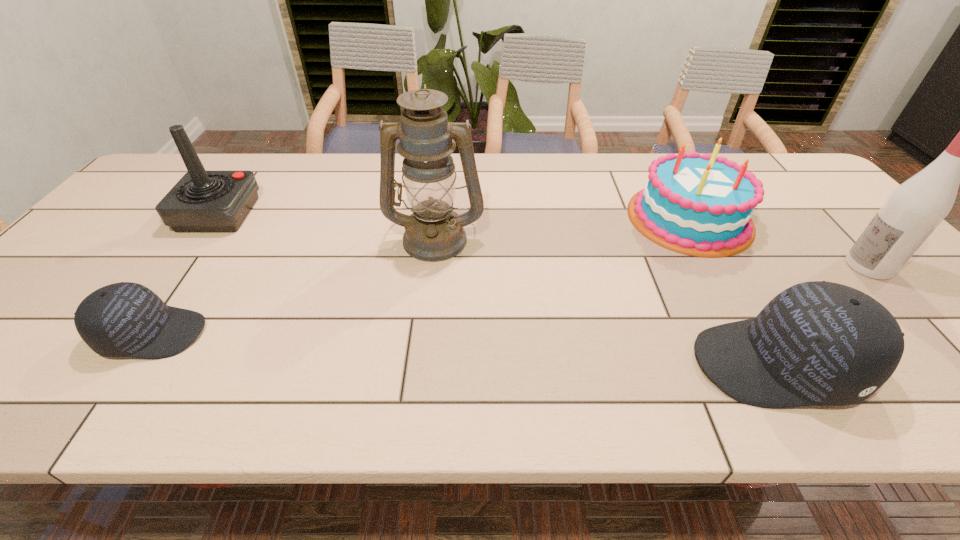
Locate an element on the screen. the left baseball cap is located at coordinates (125, 319).

Locate an element on the screen. the shortest object is located at coordinates (125, 319).

The width and height of the screenshot is (960, 540). What are the coordinates of `the taller baseball cap` in the screenshot? It's located at (818, 343).

Locate an element on the screen. birthday cake is located at coordinates (700, 205).

You are a GUI agent. You are given a task and a screenshot of the screen. Output one action in this format:
    pyautogui.click(x=<x>, y=<y>)
    Task: Click on the alcohol
    Image resolution: width=960 pixels, height=540 pixels.
    Given the screenshot: What is the action you would take?
    pyautogui.click(x=915, y=208)

Where is `the third tallest object`? This screenshot has height=540, width=960. the third tallest object is located at coordinates (201, 201).

Locate an element on the screen. This screenshot has width=960, height=540. the fourth object from right to left is located at coordinates (433, 232).

Identify the location of vacant space situated at the front of the left baseball cap where the brim is located. (236, 334).

Identify the location of vacant space located 0.150m at the front of the taller baseball cap where the brim is located. This screenshot has height=540, width=960. (621, 364).

The height and width of the screenshot is (540, 960). In order to click on vacant position located 0.220m at the front of the taller baseball cap where the brim is located in this screenshot , I will do `click(587, 364)`.